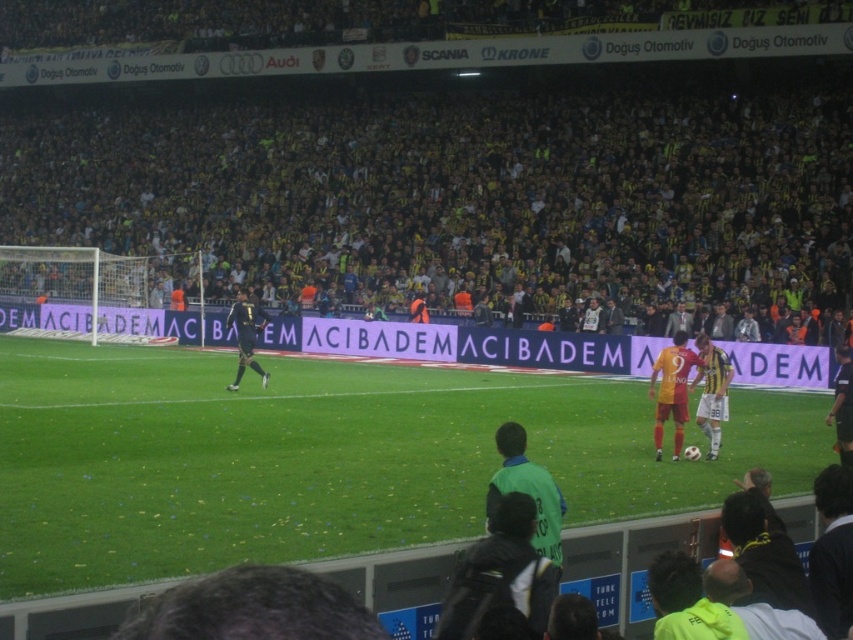
Can you confirm if dark green jersey at lower center is positioned below dark blue jersey at center?

Correct, dark green jersey at lower center is located below dark blue jersey at center.

Does dark green jersey at lower center come in front of dark blue jersey at center?

That is True.

Between point (489, 554) and point (260, 326), which one is positioned behind?

Point (260, 326)

Locate an element on the screen. This screenshot has height=640, width=853. dark green jersey at lower center is located at coordinates (500, 573).

Looking at this image, can you confirm if yellow/yellowish fabric at upper center is positioned to the left of green jersey at center?

Correct, you'll find yellow/yellowish fabric at upper center to the left of green jersey at center.

Between yellow/yellowish fabric at upper center and green jersey at center, which one appears on the left side from the viewer's perspective?

yellow/yellowish fabric at upper center

Is point (407, 116) closer to camera compared to point (540, 465)?

That is False.

At what (x,y) coordinates should I click in order to perform the action: click on yellow/yellowish fabric at upper center. Please return your answer as a coordinate pair (x, y). The image size is (853, 640). Looking at the image, I should click on (457, 192).

Who is more forward, (x=527, y=636) or (x=509, y=449)?

Point (x=527, y=636) is more forward.

This screenshot has width=853, height=640. I want to click on dark green jersey at lower center, so click(x=500, y=573).

The width and height of the screenshot is (853, 640). What are the coordinates of `dark green jersey at lower center` in the screenshot? It's located at (500, 573).